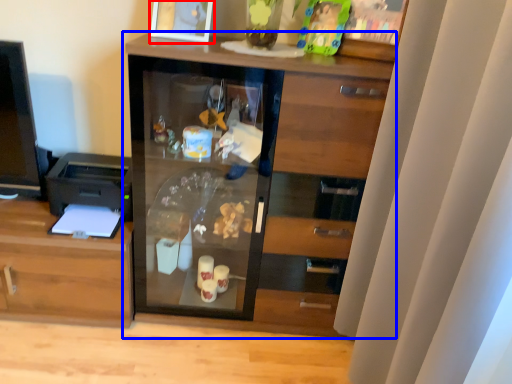
Question: Which of the following is the farthest to the observer, picture frame (highlighted by a red box) or cupboard (highlighted by a blue box)?

Choices:
 (A) picture frame
 (B) cupboard

Answer: (A)